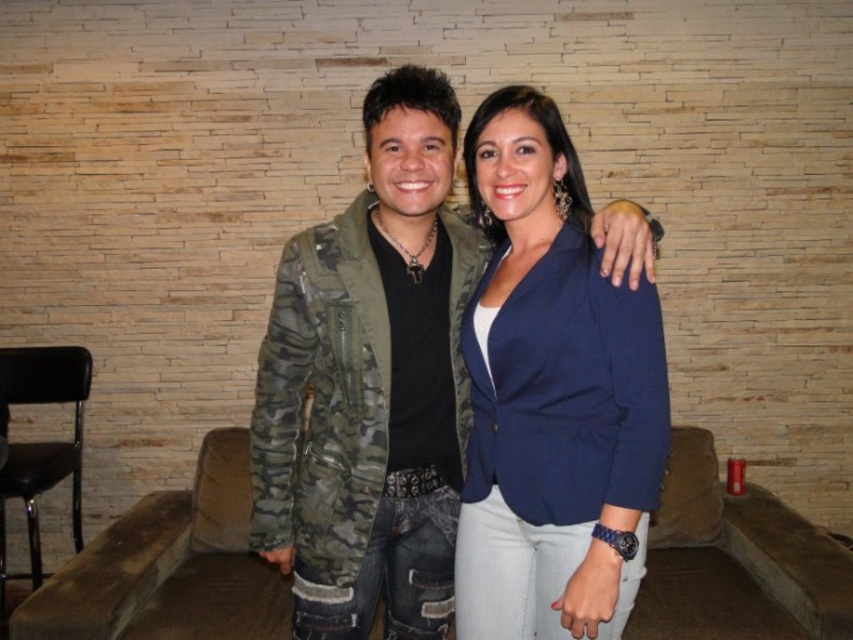
You are an interior designer planning to place a decorative item on a bench in the lounge. The bench is positioned where the camo jacket at center is currently located. Can you confirm if the bench is at the center of the image?

The camo jacket at center is located at point (370, 384), which is slightly to the right of the image center. Therefore, the bench is not exactly at the center but positioned slightly to the right.

You are a photographer setting up a shot of the two people wearing the camo jacket at center and navy blue blazer at center. You want to ensure both are in focus. Since the camera can only focus on one subject at a time, which one should you choose to focus on first to maximize the chance that both are sharp?

The camo jacket at center is closer to the viewer than the navy blue blazer at center. By focusing on the camo jacket at center, the depth of field may extend to include the navy blue blazer at center, increasing the likelihood that both are in focus.

You are a photographer trying to capture the perfect shot of the two people in the scene. You want to focus on the camo jacket at center located at point (370, 384). Where exactly should you aim your camera to ensure the camo jacket at center is in the center of your frame?

To center the camo jacket at center located at point (370, 384) in your frame, aim your camera directly at the coordinates 0.600 on the x axis and 0.436 on the y axis.